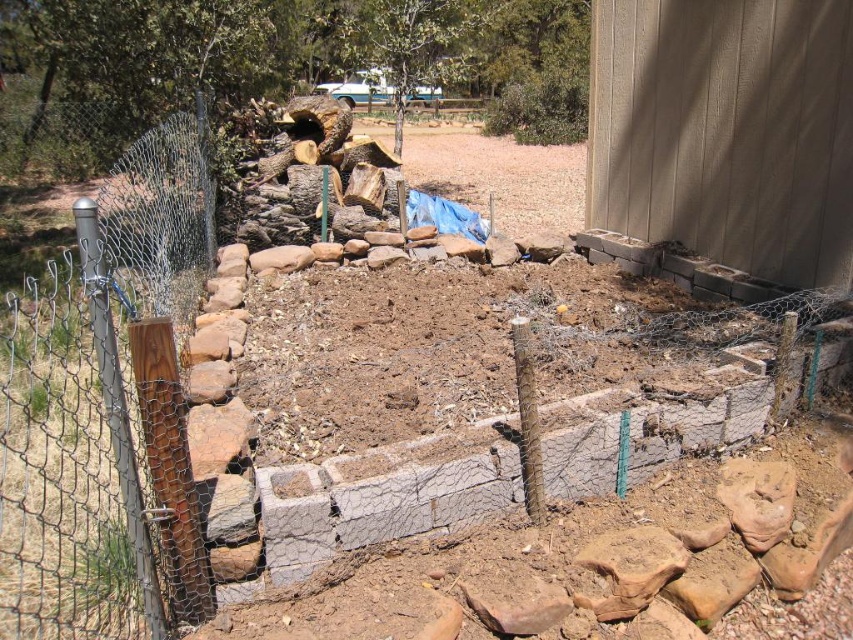
You are a landscape architect designing the backyard. You need to install a new light pole that requires a base taller than the brown wooden post at left. Can the brown soil at center provide a sufficient height for the base?

The brown wooden post at left is not as tall as brown soil at center, so the soil at center is taller. Therefore, the brown soil at center can provide a sufficient height for the light pole base since it is taller than the brown wooden post at left.

You are standing in the backyard and want to place a small potted plant between the two points marked as point (x=91, y=552) and point (x=572, y=208). Which point should the plant be closer to if you want it to be nearer to the retaining wall under construction?

The plant should be placed closer to point (x=91, y=552) because it is closer to the viewer than point (x=572, y=208), which would position it nearer to the retaining wall under construction.